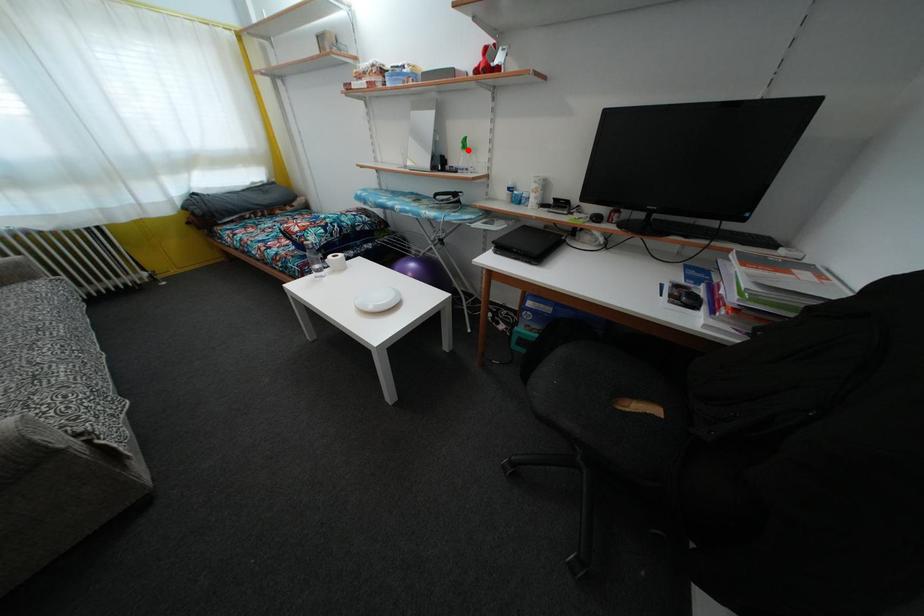
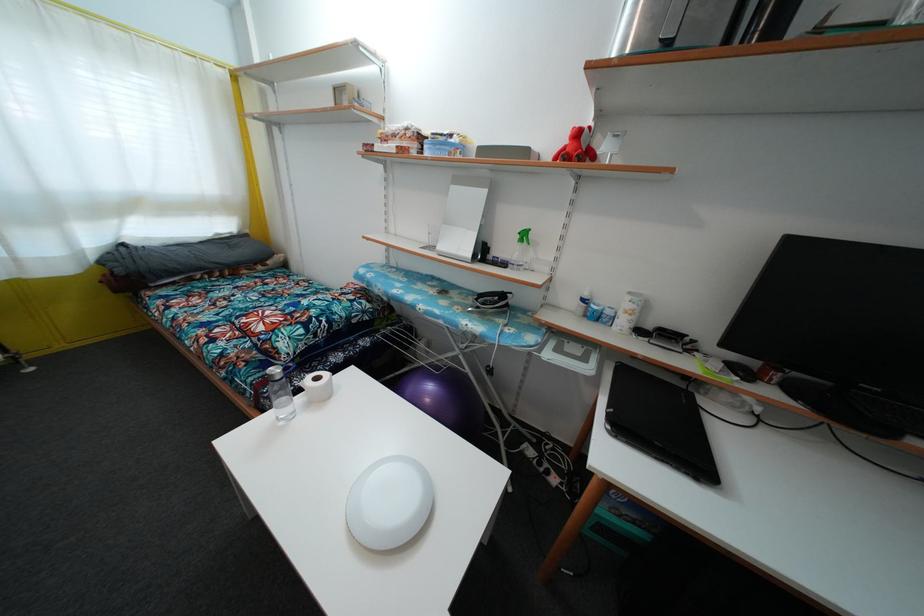
In the second image, find the point that corresponds to the highlighted location in the first image.

(528, 241)